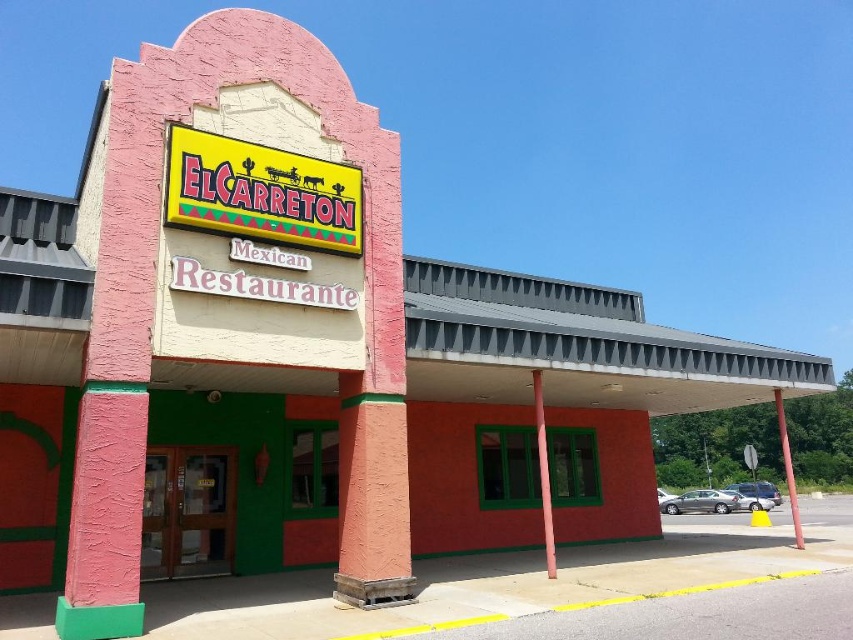
You are standing in front of the restaurant and want to hang a new menu board. The menu board is heavier than the yellow plastic sign at center. If you want to hang it on the same pole as the pink matte pole at center, where should you place it to avoid it being blocked by the existing sign?

The yellow plastic sign at center is above the pink matte pole at center, so you should place the new menu board below the yellow plastic sign at center to avoid it being blocked.

You are a customer standing in front of the entrance of El Carreton. You see the pink matte pole at center and the red painted metal pole at center. Which pole is taller?

The red painted metal pole at center is taller than the pink matte pole at center.